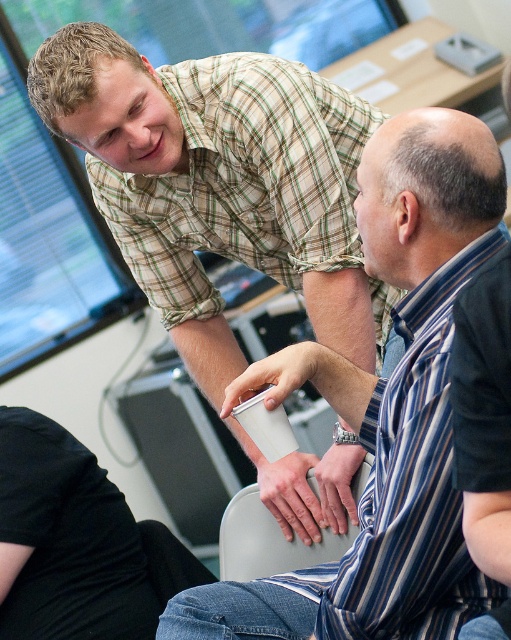
Can you confirm if matte plaid shirt at upper left is positioned below gray plastic chair at lower center?

No, matte plaid shirt at upper left is not below gray plastic chair at lower center.

How distant is matte plaid shirt at upper left from gray plastic chair at lower center?

The distance of matte plaid shirt at upper left from gray plastic chair at lower center is 18.32 inches.

Who is more forward, (222, 253) or (349, 541)?

Point (349, 541)

You are a GUI agent. You are given a task and a screenshot of the screen. Output one action in this format:
    pyautogui.click(x=<x>, y=<y>)
    Task: Click on the matte plaid shirt at upper left
    
    Given the screenshot: What is the action you would take?
    pyautogui.click(x=220, y=184)

Between matte plaid shirt at upper left and green plaid shirt at upper center, which one has less height?

green plaid shirt at upper center

Does matte plaid shirt at upper left have a greater width compared to green plaid shirt at upper center?

Yes.

Which is in front, point (194, 346) or point (389, 524)?

Point (389, 524)

The image size is (511, 640). Find the location of `matte plaid shirt at upper left`. matte plaid shirt at upper left is located at coordinates (220, 184).

Can you confirm if green plaid shirt at upper center is taller than gray plastic chair at lower center?

Indeed, green plaid shirt at upper center has a greater height compared to gray plastic chair at lower center.

Can you confirm if green plaid shirt at upper center is wider than gray plastic chair at lower center?

Yes, green plaid shirt at upper center is wider than gray plastic chair at lower center.

The height and width of the screenshot is (640, 511). I want to click on green plaid shirt at upper center, so click(384, 406).